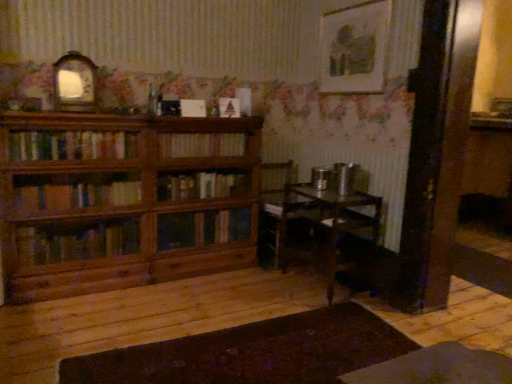
Question: Is wooden table at center far away from matte white triangle at center, the 2th book from the bottom?

Choices:
 (A) no
 (B) yes

Answer: (B)

Question: Considering the relative sizes of wooden table at center and matte white triangle at center, arranged as the first book when viewed from the top, in the image provided, is wooden table at center shorter than matte white triangle at center, arranged as the first book when viewed from the top,?

Choices:
 (A) no
 (B) yes

Answer: (A)

Question: Is wooden table at center to the left of matte white triangle at center, the 2th book from the bottom, from the viewer's perspective?

Choices:
 (A) no
 (B) yes

Answer: (A)

Question: Is wooden table at center facing away from matte white triangle at center, arranged as the first book when viewed from the top?

Choices:
 (A) no
 (B) yes

Answer: (A)

Question: From a real-world perspective, is wooden table at center on top of matte white triangle at center, the 2th book from the bottom?

Choices:
 (A) no
 (B) yes

Answer: (A)

Question: Is wooden table at center wider than matte white triangle at center, arranged as the first book when viewed from the top?

Choices:
 (A) no
 (B) yes

Answer: (B)

Question: Considering the relative positions of wooden bookshelf at center, which is counted as the 2th book, starting from the top, and matte white triangle at center, the 2th book from the bottom, in the image provided, is wooden bookshelf at center, which is counted as the 2th book, starting from the top, to the right of matte white triangle at center, the 2th book from the bottom, from the viewer's perspective?

Choices:
 (A) yes
 (B) no

Answer: (B)

Question: Can you confirm if wooden bookshelf at center, which is counted as the 2th book, starting from the top, is shorter than matte white triangle at center, arranged as the first book when viewed from the top?

Choices:
 (A) yes
 (B) no

Answer: (B)

Question: Is wooden bookshelf at center, acting as the first book starting from the bottom, closer to camera compared to matte white triangle at center, arranged as the first book when viewed from the top?

Choices:
 (A) no
 (B) yes

Answer: (B)

Question: Is wooden bookshelf at center, which is counted as the 2th book, starting from the top, taller than matte white triangle at center, the 2th book from the bottom?

Choices:
 (A) yes
 (B) no

Answer: (A)

Question: Is wooden bookshelf at center, which is counted as the 2th book, starting from the top, far away from matte white triangle at center, the 2th book from the bottom?

Choices:
 (A) yes
 (B) no

Answer: (B)

Question: Is matte white triangle at center, arranged as the first book when viewed from the top, a part of wooden bookshelf at center, acting as the first book starting from the bottom?

Choices:
 (A) yes
 (B) no

Answer: (B)

Question: Does matte white triangle at center, the 2th book from the bottom, appear on the left side of wooden bookcase at left?

Choices:
 (A) no
 (B) yes

Answer: (A)